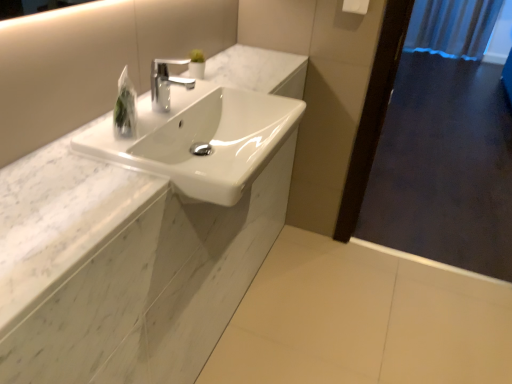
Question: Is dark wood screen door at right touching white marble counter at center?

Choices:
 (A) no
 (B) yes

Answer: (A)

Question: From the image's perspective, is dark wood screen door at right on white marble counter at center?

Choices:
 (A) no
 (B) yes

Answer: (A)

Question: Does dark wood screen door at right have a smaller size compared to white marble counter at center?

Choices:
 (A) no
 (B) yes

Answer: (A)

Question: Does dark wood screen door at right lie in front of white marble counter at center?

Choices:
 (A) no
 (B) yes

Answer: (A)

Question: Is dark wood screen door at right at the right side of white marble counter at center?

Choices:
 (A) no
 (B) yes

Answer: (B)

Question: Is polished chrome faucet at center taller or shorter than white glossy sink at center?

Choices:
 (A) tall
 (B) short

Answer: (B)

Question: From the image's perspective, is polished chrome faucet at center above or below white glossy sink at center?

Choices:
 (A) above
 (B) below

Answer: (A)

Question: Is point (189, 87) closer or farther from the camera than point (232, 122)?

Choices:
 (A) closer
 (B) farther

Answer: (B)

Question: Considering their positions, is polished chrome faucet at center located in front of or behind white glossy sink at center?

Choices:
 (A) behind
 (B) front

Answer: (A)

Question: From a real-world perspective, relative to polished chrome faucet at center, is white plastic towel bar at upper right vertically above or below?

Choices:
 (A) above
 (B) below

Answer: (A)

Question: Is white plastic towel bar at upper right spatially inside polished chrome faucet at center, or outside of it?

Choices:
 (A) outside
 (B) inside

Answer: (A)

Question: Is white plastic towel bar at upper right in front of or behind polished chrome faucet at center in the image?

Choices:
 (A) front
 (B) behind

Answer: (B)

Question: Looking at their shapes, would you say white plastic towel bar at upper right is wider or thinner than polished chrome faucet at center?

Choices:
 (A) thin
 (B) wide

Answer: (A)

Question: From a real-world perspective, is white marble counter at center above or below white glossy sink at center?

Choices:
 (A) below
 (B) above

Answer: (B)

Question: Is point (175, 276) closer or farther from the camera than point (265, 104)?

Choices:
 (A) farther
 (B) closer

Answer: (B)